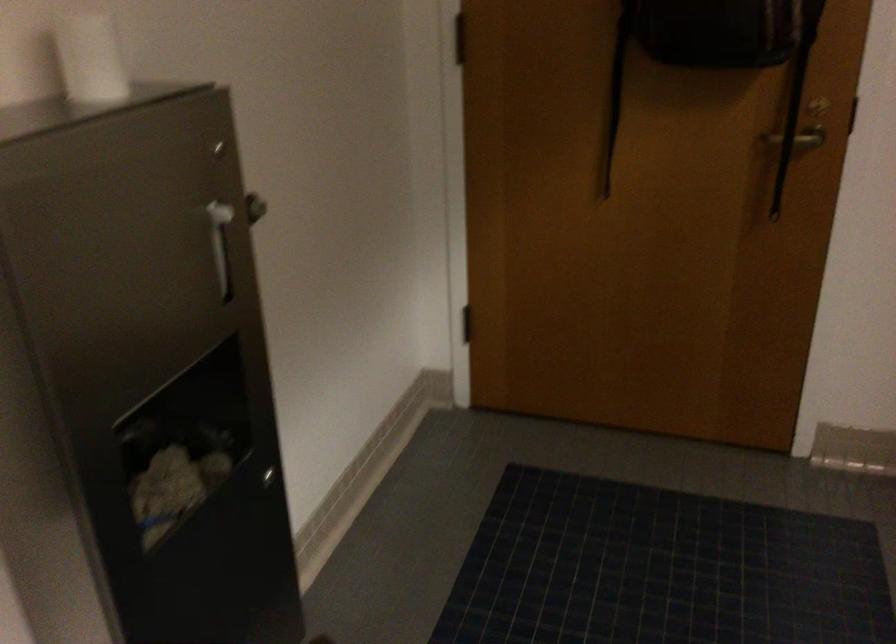
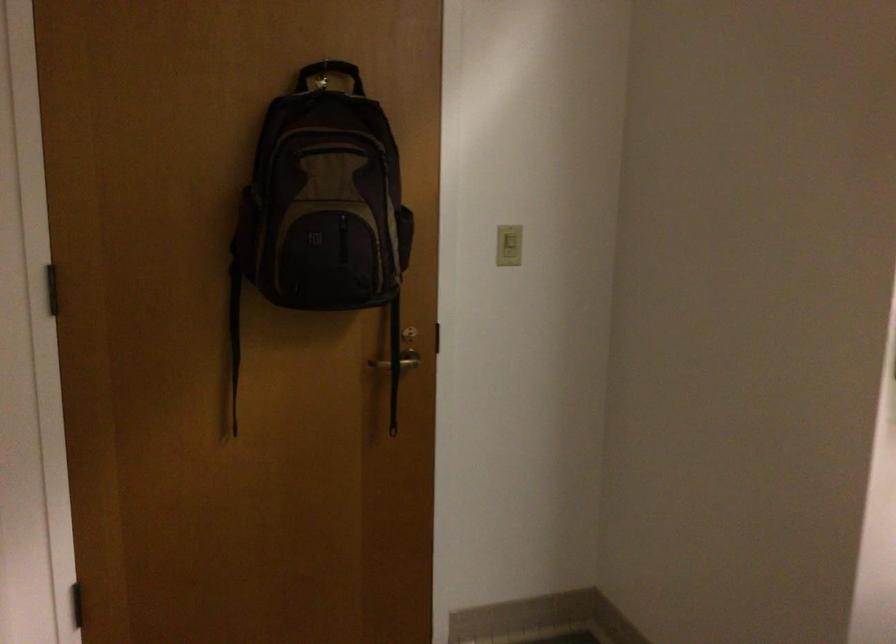
Question: The camera is either moving clockwise (left) or counter-clockwise (right) around the object. The first image is from the beginning of the video and the second image is from the end. Is the camera moving left or right when shooting the video?

Choices:
 (A) Left
 (B) Right

Answer: (A)